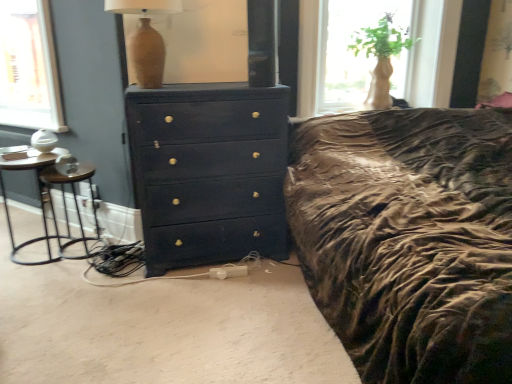
Question: Can you confirm if matte beige vase at upper center is thinner than translucent glass vase at upper right?

Choices:
 (A) yes
 (B) no

Answer: (A)

Question: Does matte beige vase at upper center come behind translucent glass vase at upper right?

Choices:
 (A) yes
 (B) no

Answer: (B)

Question: Does matte beige vase at upper center have a lesser height compared to translucent glass vase at upper right?

Choices:
 (A) no
 (B) yes

Answer: (B)

Question: From a real-world perspective, is matte beige vase at upper center positioned under translucent glass vase at upper right based on gravity?

Choices:
 (A) yes
 (B) no

Answer: (B)

Question: Is matte beige vase at upper center closer to camera compared to translucent glass vase at upper right?

Choices:
 (A) yes
 (B) no

Answer: (A)

Question: Based on their sizes in the image, would you say black metal bar stool at left is bigger or smaller than metallic silver side table at left?

Choices:
 (A) big
 (B) small

Answer: (B)

Question: Considering the positions of point (84, 253) and point (7, 150), is point (84, 253) closer or farther from the camera than point (7, 150)?

Choices:
 (A) closer
 (B) farther

Answer: (A)

Question: In terms of height, does black metal bar stool at left look taller or shorter compared to metallic silver side table at left?

Choices:
 (A) short
 (B) tall

Answer: (A)

Question: From a real-world perspective, is black metal bar stool at left positioned above or below metallic silver side table at left?

Choices:
 (A) below
 (B) above

Answer: (A)

Question: Which is correct: matte beige vase at upper center is inside translucent glass vase at upper right, or outside of it?

Choices:
 (A) outside
 (B) inside

Answer: (A)

Question: From the image's perspective, relative to translucent glass vase at upper right, is matte beige vase at upper center above or below?

Choices:
 (A) below
 (B) above

Answer: (A)

Question: Is matte beige vase at upper center in front of or behind translucent glass vase at upper right in the image?

Choices:
 (A) behind
 (B) front

Answer: (B)

Question: Is matte beige vase at upper center wider or thinner than translucent glass vase at upper right?

Choices:
 (A) thin
 (B) wide

Answer: (A)

Question: Looking at their shapes, would you say metallic silver side table at left is wider or thinner than black metal bar stool at left?

Choices:
 (A) wide
 (B) thin

Answer: (B)

Question: Considering the positions of point (47, 246) and point (99, 233), is point (47, 246) closer or farther from the camera than point (99, 233)?

Choices:
 (A) closer
 (B) farther

Answer: (A)